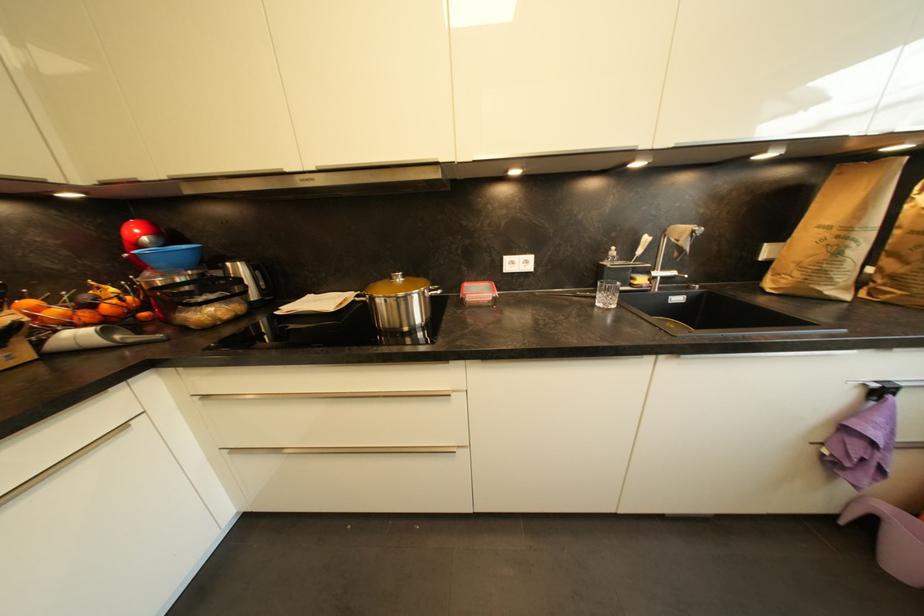
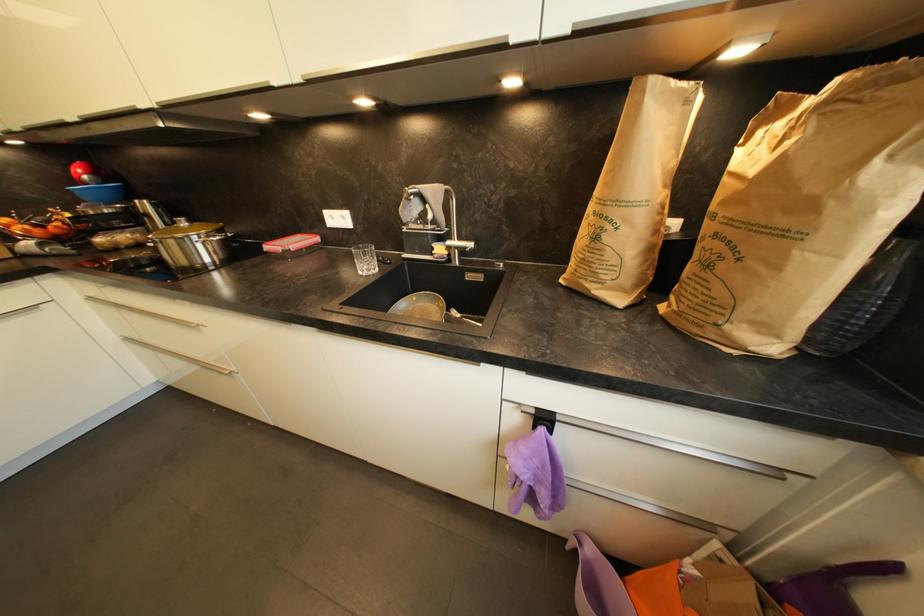
Question: What movement of the cameraman would produce the second image?

Choices:
 (A) Left
 (B) Right
 (C) Forward
 (D) Backward

Answer: (B)